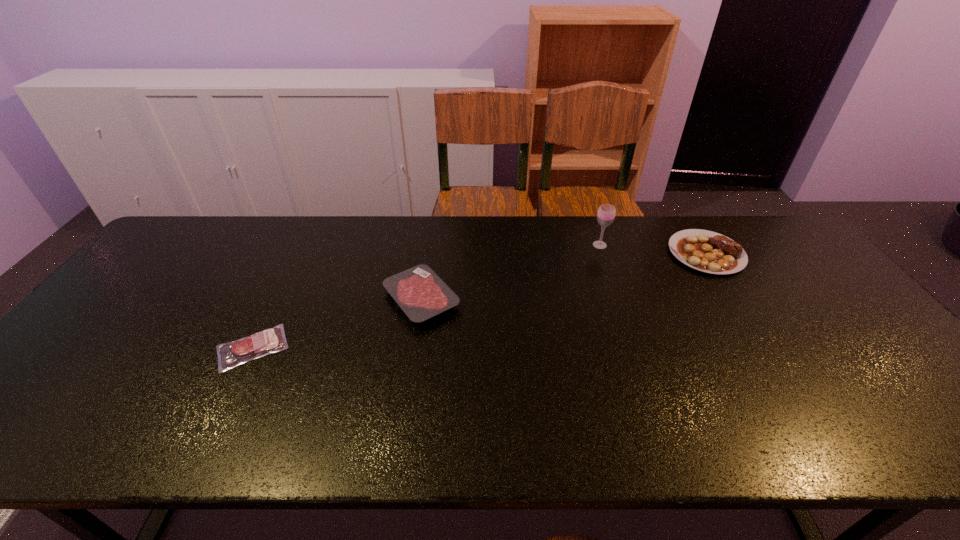
Image resolution: width=960 pixels, height=540 pixels. I want to click on vacant space located on the left of the second object from left to right, so click(x=250, y=299).

I want to click on free location located on the left of the leftmost steak, so click(x=125, y=348).

Where is `wineglass at the far edge`? Image resolution: width=960 pixels, height=540 pixels. wineglass at the far edge is located at coordinates (606, 213).

Where is `steak present at the far edge`? Image resolution: width=960 pixels, height=540 pixels. steak present at the far edge is located at coordinates tap(703, 250).

Where is `vacant space at the far edge`? vacant space at the far edge is located at coordinates (324, 220).

The image size is (960, 540). I want to click on free space at the near edge of the desktop, so click(383, 436).

I want to click on blank space at the left edge of the desktop, so click(x=108, y=383).

In the image, there is a desktop. Where is `free space at the far left corner`? The image size is (960, 540). free space at the far left corner is located at coordinates (220, 234).

At what (x,y) coordinates should I click in order to perform the action: click on free point at the near left corner. Please return your answer as a coordinate pair (x, y). The image size is (960, 540). Looking at the image, I should click on (16, 423).

This screenshot has height=540, width=960. Find the location of `free point between the wineglass and the rightmost object`. free point between the wineglass and the rightmost object is located at coordinates (653, 249).